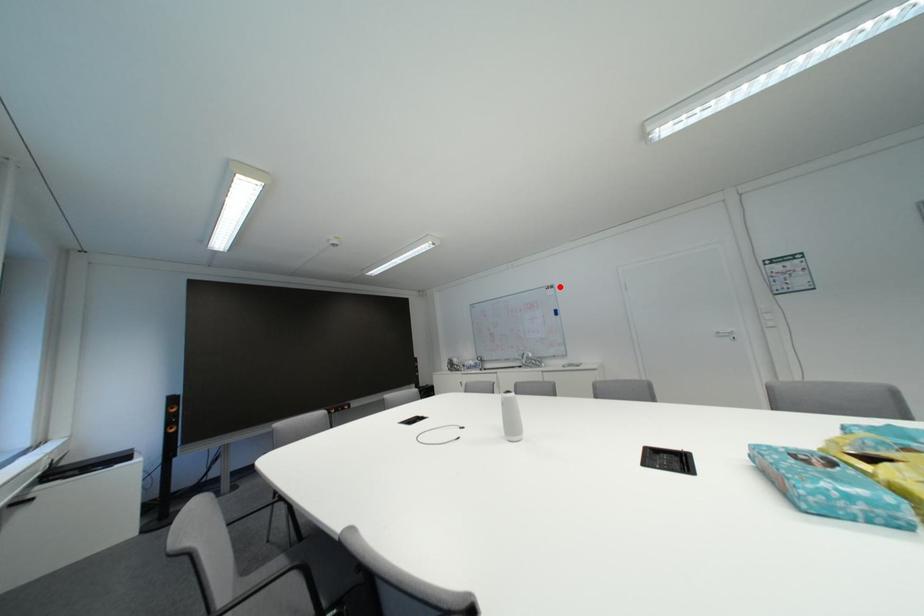
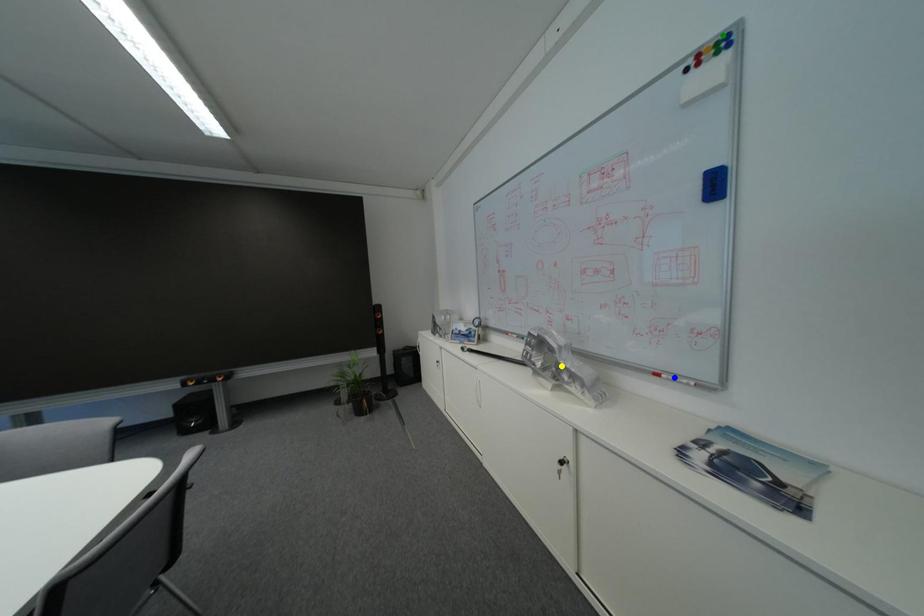
Question: I am providing you with two images of the same scene from different viewpoints. A red point is marked on the first image. You are given multiple points on the second image. Which spot in image 2 lines up with the point in image 1?

Choices:
 (A) green point
 (B) blue point
 (C) yellow point

Answer: (A)